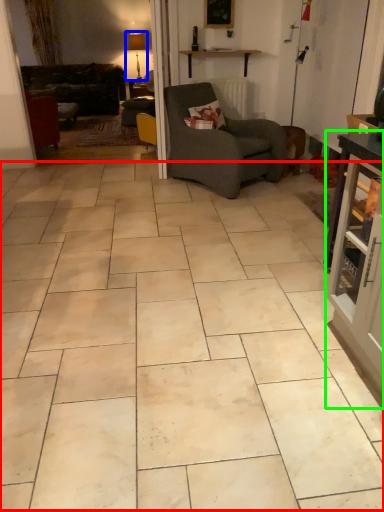
Question: Which is nearer to the ceramic tile (highlighted by a red box)? lamp (highlighted by a blue box) or cabinetry (highlighted by a green box).

Choices:
 (A) lamp
 (B) cabinetry

Answer: (B)